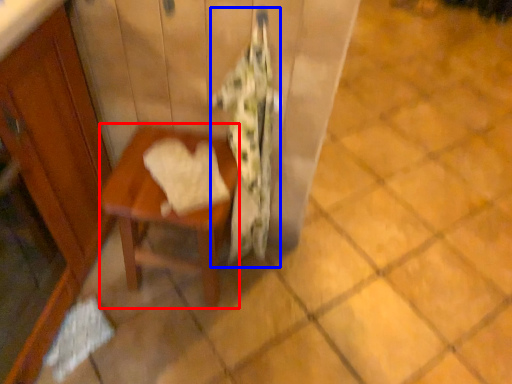
Question: Which object is closer to the camera taking this photo, table (highlighted by a red box) or blanket (highlighted by a blue box)?

Choices:
 (A) table
 (B) blanket

Answer: (B)